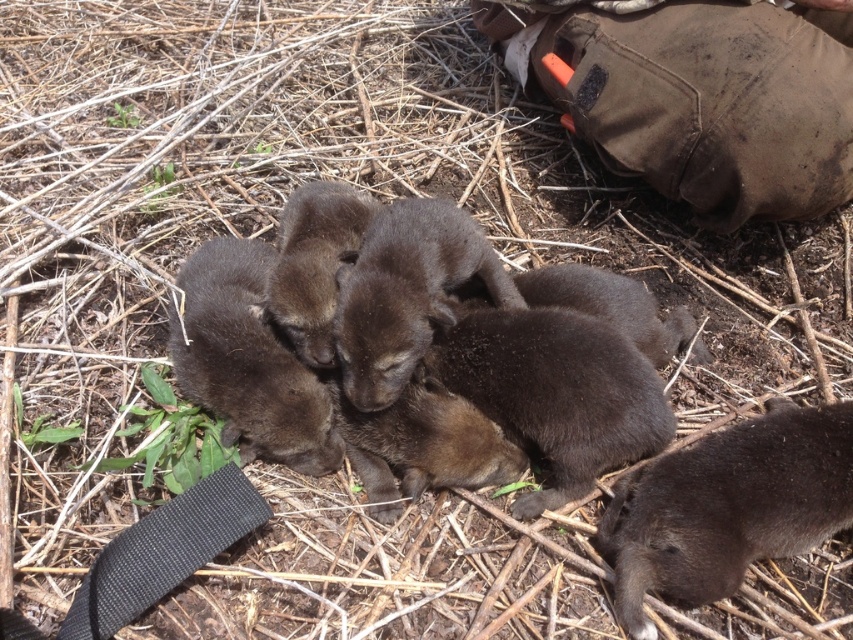
Question: Does brown canvas pants at upper right have a larger size compared to brown fur at lower right?

Choices:
 (A) yes
 (B) no

Answer: (A)

Question: Among these points, which one is farthest from the camera?

Choices:
 (A) (769, 512)
 (B) (810, 77)

Answer: (B)

Question: Can you confirm if brown canvas pants at upper right is wider than brown fur at lower right?

Choices:
 (A) yes
 (B) no

Answer: (A)

Question: Which object is farther from the camera taking this photo?

Choices:
 (A) brown canvas pants at upper right
 (B) brown fur at lower right

Answer: (A)

Question: Does brown canvas pants at upper right have a greater width compared to brown fur at lower right?

Choices:
 (A) no
 (B) yes

Answer: (B)

Question: Which of the following is the closest to the observer?

Choices:
 (A) brown canvas pants at upper right
 (B) brown fur at lower right

Answer: (B)